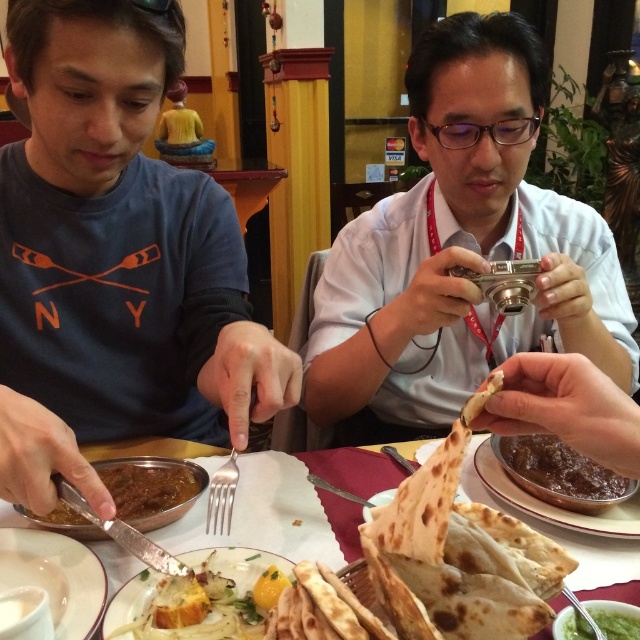
Can you confirm if brown matte curry at lower left is positioned to the right of green smoothie at center?

In fact, brown matte curry at lower left is to the left of green smoothie at center.

Measure the distance between point (x=102, y=476) and camera.

Point (x=102, y=476) and camera are 27.09 inches apart from each other.

Does point (132, 458) come farther from viewer compared to point (624, 620)?

Yes, point (132, 458) is farther from viewer.

Where is `brown matte curry at lower left`? Image resolution: width=640 pixels, height=640 pixels. brown matte curry at lower left is located at coordinates (150, 484).

Does white ceramic plate at center have a lesser height compared to brown matte curry at lower left?

No, white ceramic plate at center is not shorter than brown matte curry at lower left.

Who is positioned more to the left, white ceramic plate at center or brown matte curry at lower left?

brown matte curry at lower left

Image resolution: width=640 pixels, height=640 pixels. I want to click on white ceramic plate at center, so click(x=291, y=506).

You are a GUI agent. You are given a task and a screenshot of the screen. Output one action in this format:
    pyautogui.click(x=<x>, y=<y>)
    Task: Click on the white ceramic plate at center
    
    Given the screenshot: What is the action you would take?
    pyautogui.click(x=291, y=506)

The width and height of the screenshot is (640, 640). Describe the element at coordinates (291, 506) in the screenshot. I see `white ceramic plate at center` at that location.

Between white ceramic plate at center and white matte plate at lower left, which one has less height?

white matte plate at lower left

I want to click on white ceramic plate at center, so click(291, 506).

Identify the location of white ceramic plate at center. The height and width of the screenshot is (640, 640). (291, 506).